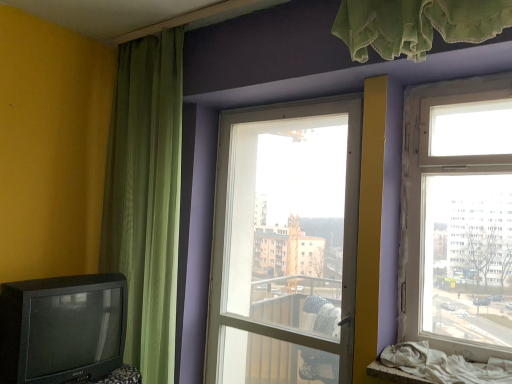
Question: From the image's perspective, is transparent glass door at center, the first window viewed from the left, over green sheer curtain at left?

Choices:
 (A) no
 (B) yes

Answer: (A)

Question: From the image's perspective, is transparent glass door at center, which is the second window from front to back, beneath green sheer curtain at left?

Choices:
 (A) no
 (B) yes

Answer: (B)

Question: Is transparent glass door at center, placed as the second window when sorted from right to left, smaller than green sheer curtain at left?

Choices:
 (A) no
 (B) yes

Answer: (A)

Question: Can you confirm if transparent glass door at center, placed as the second window when sorted from right to left, is taller than green sheer curtain at left?

Choices:
 (A) no
 (B) yes

Answer: (A)

Question: Does transparent glass door at center, the 1th window in the back-to-front sequence, turn towards green sheer curtain at left?

Choices:
 (A) yes
 (B) no

Answer: (B)

Question: Is transparent glass door at center, placed as the second window when sorted from right to left, shorter than green sheer curtain at left?

Choices:
 (A) yes
 (B) no

Answer: (A)

Question: From a real-world perspective, is green sheer curtain at left physically above transparent glass door at center, placed as the second window when sorted from right to left?

Choices:
 (A) no
 (B) yes

Answer: (B)

Question: Is green sheer curtain at left positioned in front of transparent glass door at center, placed as the second window when sorted from right to left?

Choices:
 (A) no
 (B) yes

Answer: (A)

Question: Can you confirm if green sheer curtain at left is wider than transparent glass door at center, placed as the second window when sorted from right to left?

Choices:
 (A) no
 (B) yes

Answer: (B)

Question: Considering the relative positions of green sheer curtain at left and transparent glass door at center, placed as the second window when sorted from right to left, in the image provided, is green sheer curtain at left to the left of transparent glass door at center, placed as the second window when sorted from right to left, from the viewer's perspective?

Choices:
 (A) yes
 (B) no

Answer: (A)

Question: From a real-world perspective, is green sheer curtain at left physically below transparent glass door at center, the 1th window in the back-to-front sequence?

Choices:
 (A) no
 (B) yes

Answer: (A)

Question: Considering the relative sizes of green sheer curtain at left and transparent glass door at center, the 1th window in the back-to-front sequence, in the image provided, is green sheer curtain at left smaller than transparent glass door at center, the 1th window in the back-to-front sequence,?

Choices:
 (A) yes
 (B) no

Answer: (A)

Question: Is clear glass window at upper right, the second window positioned from the back, inside matte black television at lower left?

Choices:
 (A) no
 (B) yes

Answer: (A)